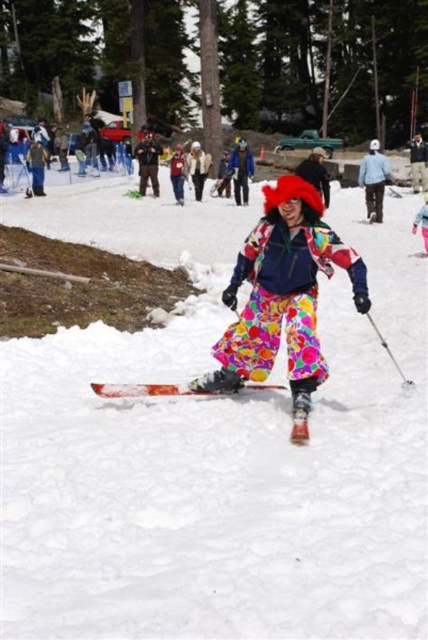
Between white snow at center and matte black jacket at upper center, which one has more height?

Standing taller between the two is white snow at center.

Who is higher up, white snow at center or matte black jacket at upper center?

matte black jacket at upper center is above.

Is point (404, 339) closer to viewer compared to point (146, 170)?

Yes, it is in front of point (146, 170).

What are the coordinates of `white snow at center` in the screenshot? It's located at (214, 448).

Can you confirm if orange metallic ski at center is taller than matte black jacket at upper center?

In fact, orange metallic ski at center may be shorter than matte black jacket at upper center.

Which is above, orange metallic ski at center or matte black jacket at upper center?

matte black jacket at upper center is higher up.

Identify the location of orange metallic ski at center. This screenshot has height=640, width=428. (148, 390).

Image resolution: width=428 pixels, height=640 pixels. What are the coordinates of `orange metallic ski at center` in the screenshot? It's located at (148, 390).

Between orange metallic ski at center and fluorescent pink snowsuit at center, which one is positioned higher?

fluorescent pink snowsuit at center is higher up.

Who is more distant from viewer, (297, 408) or (427, 218)?

The point (427, 218) is more distant.

The image size is (428, 640). I want to click on orange metallic ski at center, so click(x=148, y=390).